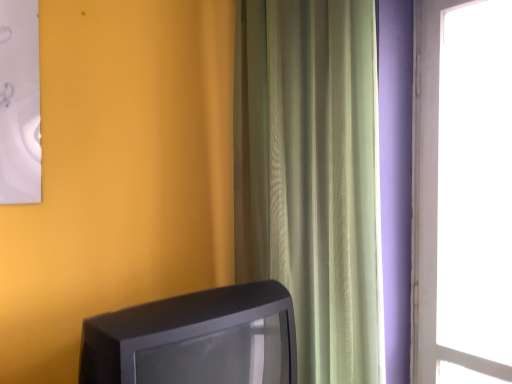
Question: From the image's perspective, is green textured curtain at center above or below matte black television at lower left?

Choices:
 (A) above
 (B) below

Answer: (A)

Question: Is point (322, 0) closer or farther from the camera than point (87, 365)?

Choices:
 (A) closer
 (B) farther

Answer: (B)

Question: Looking at the image, does green textured curtain at center seem bigger or smaller compared to matte black television at lower left?

Choices:
 (A) small
 (B) big

Answer: (B)

Question: Is matte black television at lower left situated inside green textured curtain at center or outside?

Choices:
 (A) outside
 (B) inside

Answer: (A)

Question: Relative to green textured curtain at center, is matte black television at lower left in front or behind?

Choices:
 (A) behind
 (B) front

Answer: (B)

Question: Does point (244, 375) appear closer or farther from the camera than point (342, 210)?

Choices:
 (A) farther
 (B) closer

Answer: (B)

Question: Is matte black television at lower left to the left or to the right of green textured curtain at center in the image?

Choices:
 (A) right
 (B) left

Answer: (B)